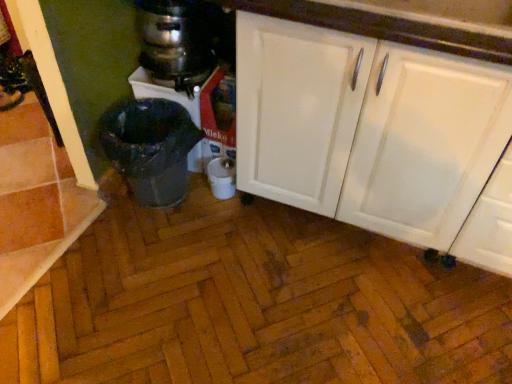
Describe the element at coordinates (151, 148) in the screenshot. I see `shiny metallic trash can at lower left` at that location.

Describe the element at coordinates (185, 64) in the screenshot. Image resolution: width=512 pixels, height=384 pixels. I see `metallic silver blender at center` at that location.

Where is `metallic silver blender at center`? This screenshot has height=384, width=512. metallic silver blender at center is located at coordinates (185, 64).

Find the location of `white glossy cabinet at upper right`. white glossy cabinet at upper right is located at coordinates (384, 27).

What do you see at coordinates (384, 27) in the screenshot? The width and height of the screenshot is (512, 384). I see `white glossy cabinet at upper right` at bounding box center [384, 27].

Where is `metallic stainless steel coffee maker at upper left`? Image resolution: width=512 pixels, height=384 pixels. metallic stainless steel coffee maker at upper left is located at coordinates (x=177, y=37).

Locate an element on the screen. The height and width of the screenshot is (384, 512). shiny metallic trash can at lower left is located at coordinates (151, 148).

From a real-world perspective, is white matte cabinet at center physically above metallic stainless steel coffee maker at upper left?

Incorrect, from a real-world perspective, white matte cabinet at center is lower than metallic stainless steel coffee maker at upper left.

Who is bigger, white matte cabinet at center or metallic stainless steel coffee maker at upper left?

white matte cabinet at center.

Is white matte cabinet at center placed right next to metallic stainless steel coffee maker at upper left?

No, white matte cabinet at center is not in contact with metallic stainless steel coffee maker at upper left.

Considering the positions of points (374, 195) and (140, 27), is point (374, 195) closer to camera compared to point (140, 27)?

That is True.

Based on the photo, considering the relative sizes of metallic stainless steel coffee maker at upper left and white glossy cabinet at upper right in the image provided, is metallic stainless steel coffee maker at upper left thinner than white glossy cabinet at upper right?

Indeed, metallic stainless steel coffee maker at upper left has a lesser width compared to white glossy cabinet at upper right.

Is metallic stainless steel coffee maker at upper left next to white glossy cabinet at upper right and touching it?

No.

Find the location of a particular element. The width and height of the screenshot is (512, 384). appliance lying on the left of white glossy cabinet at upper right is located at coordinates (177, 37).

Is point (185, 15) closer or farther from the camera than point (499, 44)?

Point (185, 15).

Is white glossy cabinet at upper right aimed at metallic stainless steel coffee maker at upper left?

No, white glossy cabinet at upper right is not turned towards metallic stainless steel coffee maker at upper left.

Considering the relative sizes of white glossy cabinet at upper right and metallic stainless steel coffee maker at upper left in the image provided, is white glossy cabinet at upper right shorter than metallic stainless steel coffee maker at upper left?

In fact, white glossy cabinet at upper right may be taller than metallic stainless steel coffee maker at upper left.

You are a GUI agent. You are given a task and a screenshot of the screen. Output one action in this format:
    pyautogui.click(x=<x>, y=<y>)
    Task: Click on the countertop positioned vertically above the metallic stainless steel coffee maker at upper left (from a real-world perspective)
    
    Given the screenshot: What is the action you would take?
    click(384, 27)

Which is behind, shiny metallic trash can at lower left or white matte cabinet at center?

Positioned behind is shiny metallic trash can at lower left.

Is white matte cabinet at center surrounded by shiny metallic trash can at lower left?

No, shiny metallic trash can at lower left does not contain white matte cabinet at center.

From a real-world perspective, is shiny metallic trash can at lower left physically located above or below white matte cabinet at center?

From a real-world perspective, shiny metallic trash can at lower left is physically below white matte cabinet at center.

Can you confirm if shiny metallic trash can at lower left is positioned to the left of white matte cabinet at center?

Yes.

How distant is white matte cabinet at center from metallic silver blender at center?

The distance of white matte cabinet at center from metallic silver blender at center is 20.40 inches.

Is white matte cabinet at center in contact with metallic silver blender at center?

white matte cabinet at center and metallic silver blender at center are not in contact.

From a real-world perspective, is white matte cabinet at center below metallic silver blender at center?

No, from a real-world perspective, white matte cabinet at center is not under metallic silver blender at center.

Is white matte cabinet at center wider than metallic silver blender at center?

Yes.

Could you tell me if metallic silver blender at center is facing metallic stainless steel coffee maker at upper left?

No, metallic silver blender at center is not aimed at metallic stainless steel coffee maker at upper left.

Where is `appliance that is above the metallic silver blender at center (from the image's perspective)`? This screenshot has height=384, width=512. appliance that is above the metallic silver blender at center (from the image's perspective) is located at coordinates click(177, 37).

Considering the sizes of objects metallic silver blender at center and metallic stainless steel coffee maker at upper left in the image provided, who is smaller, metallic silver blender at center or metallic stainless steel coffee maker at upper left?

Smaller between the two is metallic stainless steel coffee maker at upper left.

Is metallic silver blender at center located outside metallic stainless steel coffee maker at upper left?

Yes, metallic silver blender at center is located beyond the bounds of metallic stainless steel coffee maker at upper left.

Is white matte cabinet at center facing away from shiny metallic trash can at lower left?

No, white matte cabinet at center is not facing away from shiny metallic trash can at lower left.

Does point (411, 89) lie in front of point (118, 172)?

Yes, point (411, 89) is closer to viewer.

Can you tell me how much white matte cabinet at center and shiny metallic trash can at lower left differ in facing direction?

The facing directions of white matte cabinet at center and shiny metallic trash can at lower left are 6.58 degrees apart.

Does white matte cabinet at center come in front of shiny metallic trash can at lower left?

Yes, it is.

Identify the location of appliance above the white matte cabinet at center (from a real-world perspective). (177, 37).

Where is `appliance on the left side of white glossy cabinet at upper right`? The width and height of the screenshot is (512, 384). appliance on the left side of white glossy cabinet at upper right is located at coordinates [177, 37].

From the image, which object appears to be farther from metallic stainless steel coffee maker at upper left, shiny metallic trash can at lower left or white glossy cabinet at upper right?

white glossy cabinet at upper right lies further to metallic stainless steel coffee maker at upper left than the other object.

Considering their positions, is white matte cabinet at center positioned closer to metallic silver blender at center than white glossy cabinet at upper right?

white matte cabinet at center is closer to metallic silver blender at center.

Based on their spatial positions, is shiny metallic trash can at lower left or white matte cabinet at center closer to metallic stainless steel coffee maker at upper left?

Among the two, shiny metallic trash can at lower left is located nearer to metallic stainless steel coffee maker at upper left.

Estimate the real-world distances between objects in this image. Which object is closer to white matte cabinet at center, white glossy cabinet at upper right or metallic silver blender at center?

Based on the image, white glossy cabinet at upper right appears to be nearer to white matte cabinet at center.

Which object lies nearer to the anchor point white matte cabinet at center, metallic stainless steel coffee maker at upper left or shiny metallic trash can at lower left?

shiny metallic trash can at lower left.

Considering their positions, is white matte cabinet at center positioned further to shiny metallic trash can at lower left than metallic stainless steel coffee maker at upper left?

The object further to shiny metallic trash can at lower left is white matte cabinet at center.

Which object lies nearer to the anchor point metallic stainless steel coffee maker at upper left, white glossy cabinet at upper right or white matte cabinet at center?

white glossy cabinet at upper right lies closer to metallic stainless steel coffee maker at upper left than the other object.

From the image, which object appears to be nearer to shiny metallic trash can at lower left, metallic stainless steel coffee maker at upper left or white matte cabinet at center?

Based on the image, metallic stainless steel coffee maker at upper left appears to be nearer to shiny metallic trash can at lower left.

The height and width of the screenshot is (384, 512). I want to click on countertop located between shiny metallic trash can at lower left and white matte cabinet at center in the left-right direction, so click(x=384, y=27).

You are a GUI agent. You are given a task and a screenshot of the screen. Output one action in this format:
    pyautogui.click(x=<x>, y=<y>)
    Task: Click on the appliance situated between shiny metallic trash can at lower left and white glossy cabinet at upper right from left to right
    
    Given the screenshot: What is the action you would take?
    pyautogui.click(x=177, y=37)

Find the location of `appliance between metallic silver blender at center and white glossy cabinet at upper right in the horizontal direction`. appliance between metallic silver blender at center and white glossy cabinet at upper right in the horizontal direction is located at coordinates pyautogui.click(x=177, y=37).

You are a GUI agent. You are given a task and a screenshot of the screen. Output one action in this format:
    pyautogui.click(x=<x>, y=<y>)
    Task: Click on the blender located between shiny metallic trash can at lower left and white glossy cabinet at upper right in the left-right direction
    Image resolution: width=512 pixels, height=384 pixels.
    Given the screenshot: What is the action you would take?
    185,64